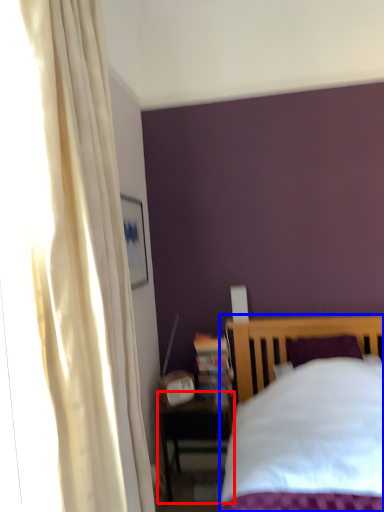
Question: Which object appears closest to the camera in this image, nightstand (highlighted by a red box) or bed (highlighted by a blue box)?

Choices:
 (A) nightstand
 (B) bed

Answer: (B)